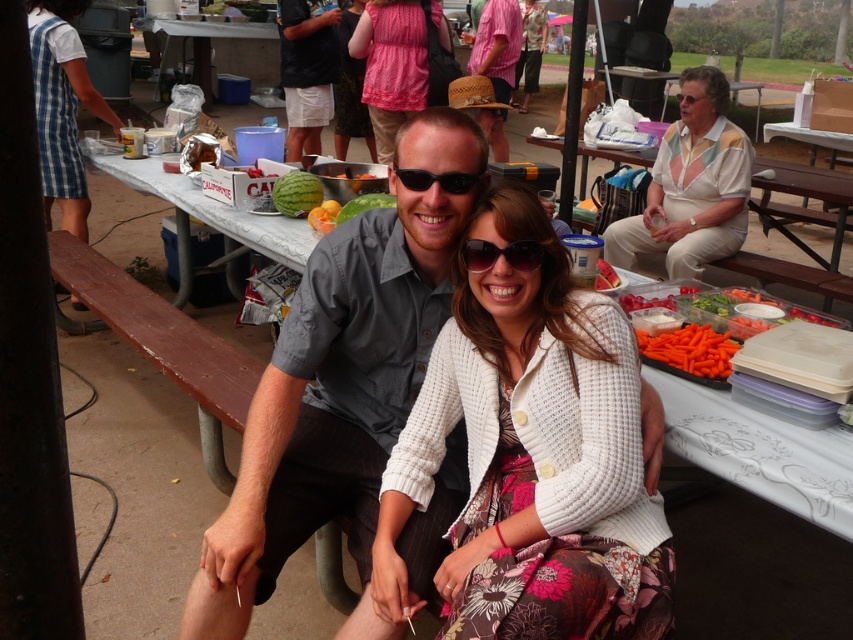
Question: Which point is farther to the camera?

Choices:
 (A) (433, 320)
 (B) (430, 179)
 (C) (328, 10)

Answer: (C)

Question: Estimate the real-world distances between objects in this image. Which object is farther from the brown wood bench at lower left?

Choices:
 (A) clear plastic goggles at upper center
 (B) blue plaid dress at left

Answer: (A)

Question: Which of the following is the farthest from the observer?

Choices:
 (A) black cotton shorts at upper center
 (B) black plastic sunglasses at center

Answer: (A)

Question: Can you confirm if blue plaid dress at left is positioned to the right of clear plastic goggles at upper center?

Choices:
 (A) no
 (B) yes

Answer: (A)

Question: Does pink fabric dress at center come in front of clear plastic goggles at upper center?

Choices:
 (A) yes
 (B) no

Answer: (B)

Question: From the image, what is the correct spatial relationship of pink fabric dress at center in relation to sunglasses at center?

Choices:
 (A) right
 (B) left

Answer: (B)